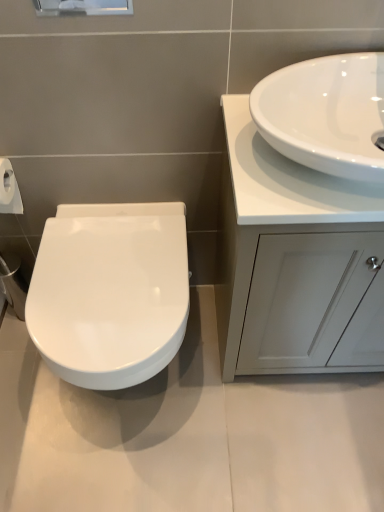
The width and height of the screenshot is (384, 512). Find the location of `vacant space in between white glossy toilet at left and white glossy cabinet at right`. vacant space in between white glossy toilet at left and white glossy cabinet at right is located at coordinates (247, 386).